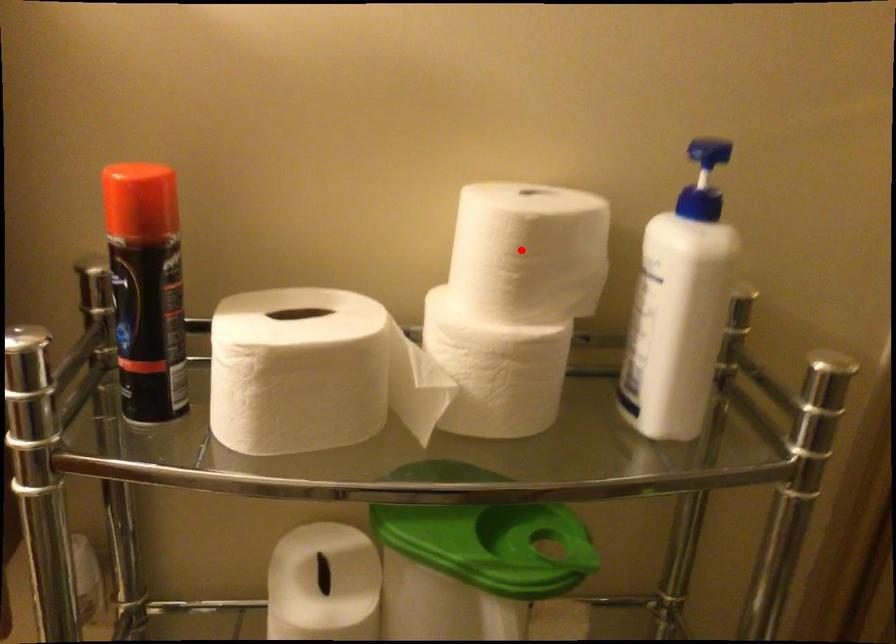
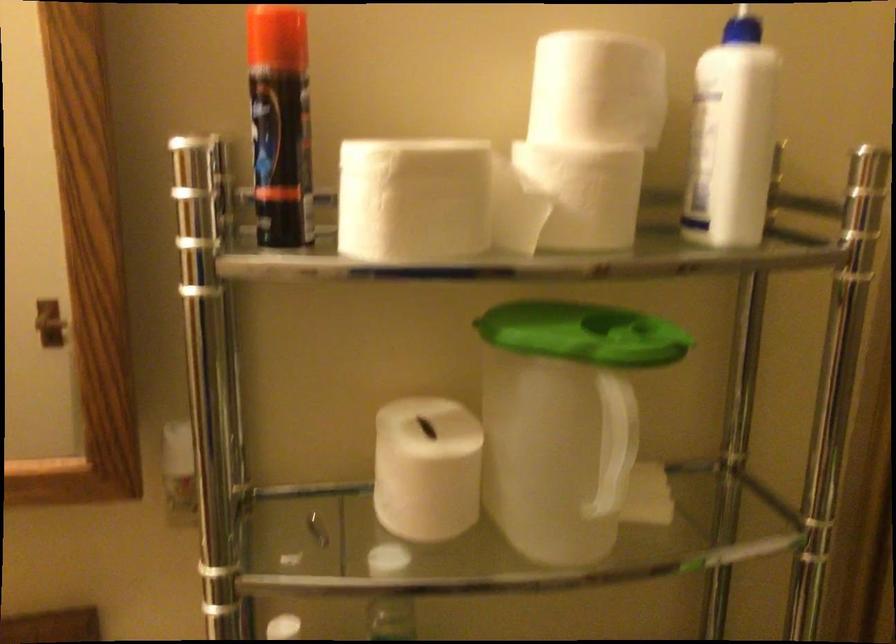
Question: I am providing you with two images of the same scene from different viewpoints. Image1 has a red point marked. In image2, the corresponding 3D location appears at what relative position? Reply with the corresponding letter.

Choices:
 (A) Closer
 (B) Farther

Answer: (B)